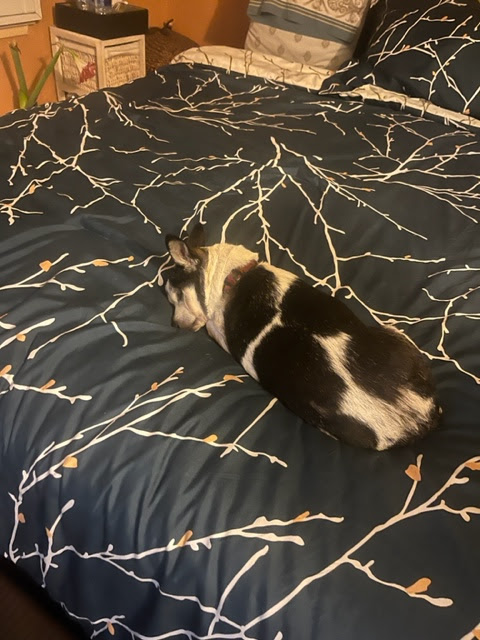
Identify the location of wall. (192, 22), (40, 41).